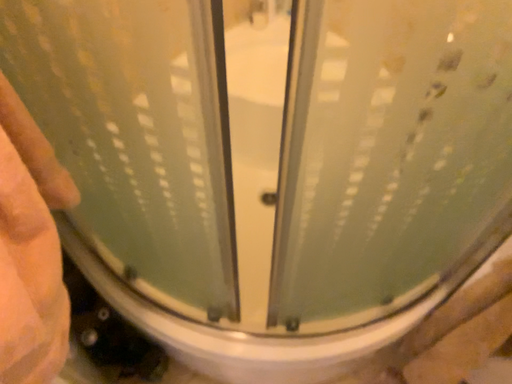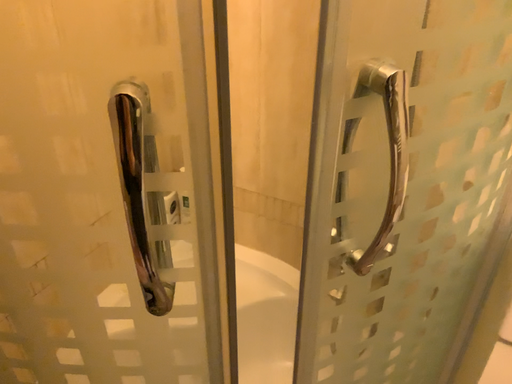
Question: Which way did the camera rotate in the video?

Choices:
 (A) rotated downward
 (B) rotated upward

Answer: (B)